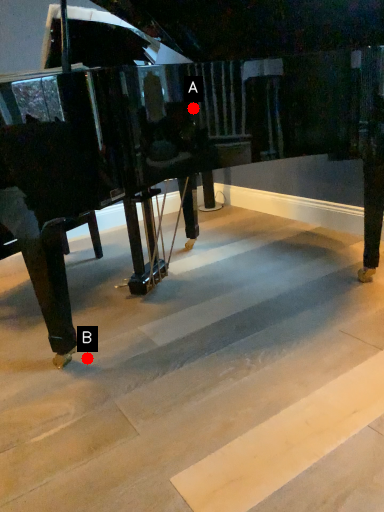
Question: Two points are circled on the image, labeled by A and B beside each circle. Which of the following is the farthest from the observer?

Choices:
 (A) A is further
 (B) B is further

Answer: (A)